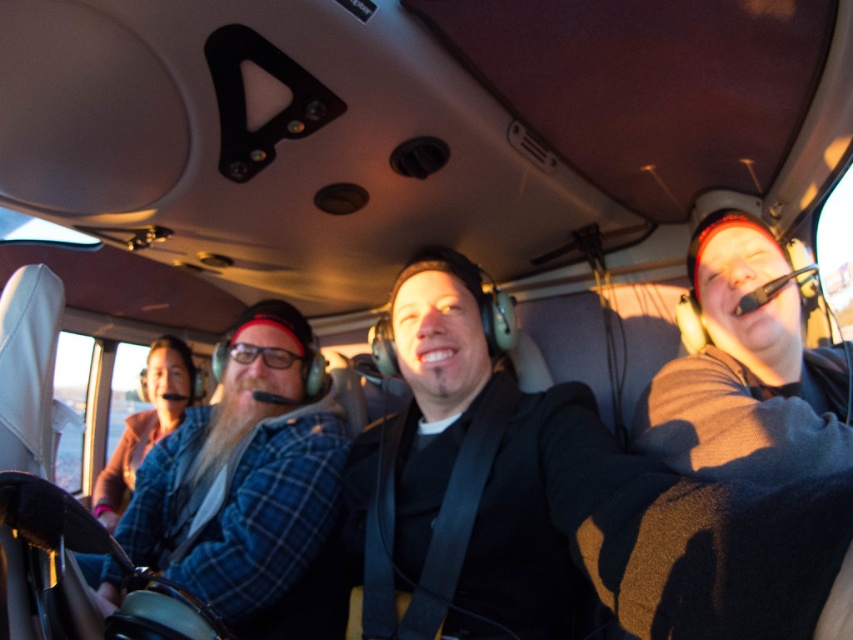
You are a flight attendant checking seat widths for passengers. The blue plaid shirt at center and the black fleece at right are seated in adjacent seats. Which seat is wider?

The blue plaid shirt at center is wider than the black fleece at right because the blue plaid shirt at center has a greater width than the black fleece at right.

You are a flight attendant checking seat assignments. You see the blue plaid shirt at center and the black fleece at right. Which passenger is seated to the left of the other?

The blue plaid shirt at center is positioned on the left side of black fleece at right, so the passenger in the blue plaid shirt at center is seated to the left of the black fleece at right.

You are a flight attendant who needs to move from the blue plaid shirt at center to the black fleece at right during a safety check. How much space do you need to navigate between them?

The distance between the blue plaid shirt at center and the black fleece at right is 33.53 inches, so the flight attendant needs to navigate a space of approximately 33.53 inches to move between them.